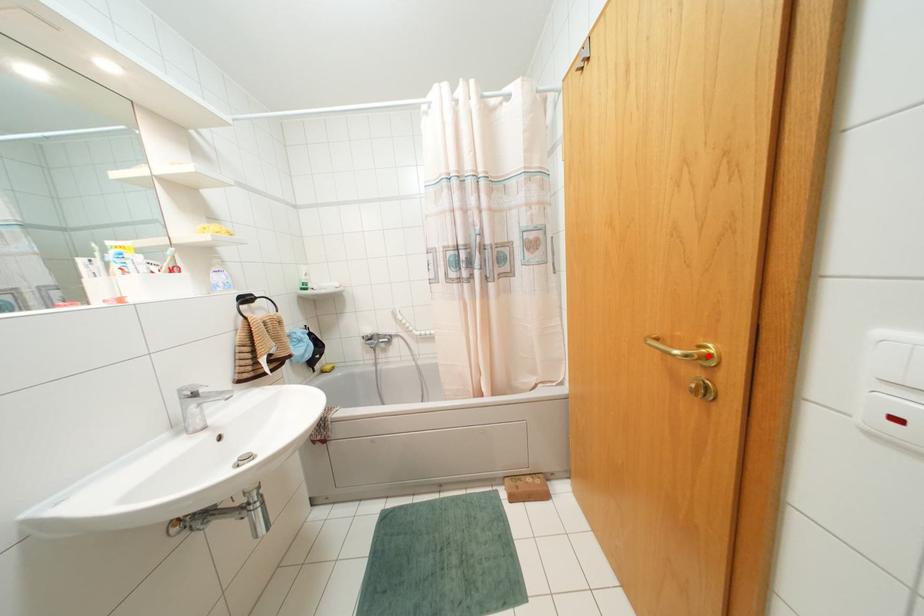
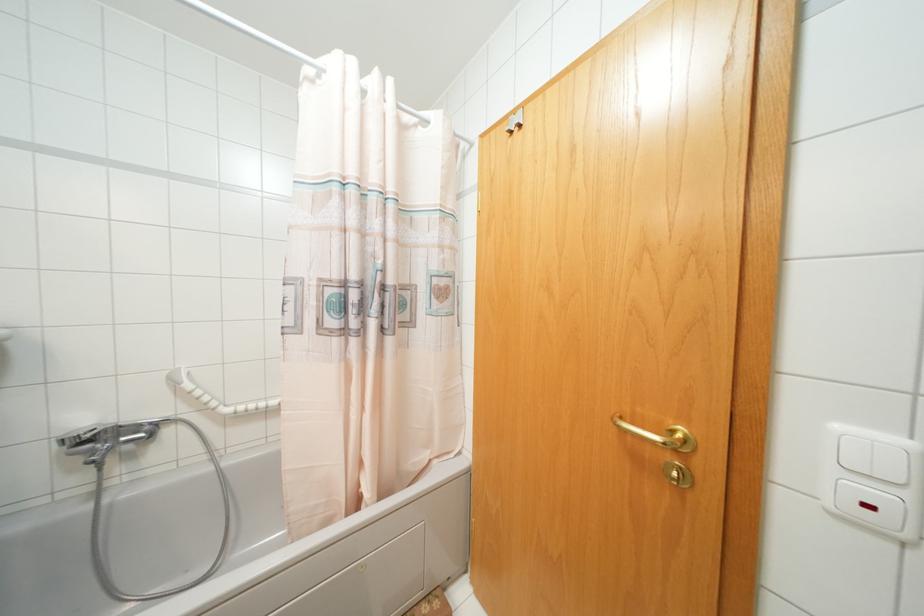
In the second image, find the point that corresponds to the highlighted location in the first image.

(686, 440)